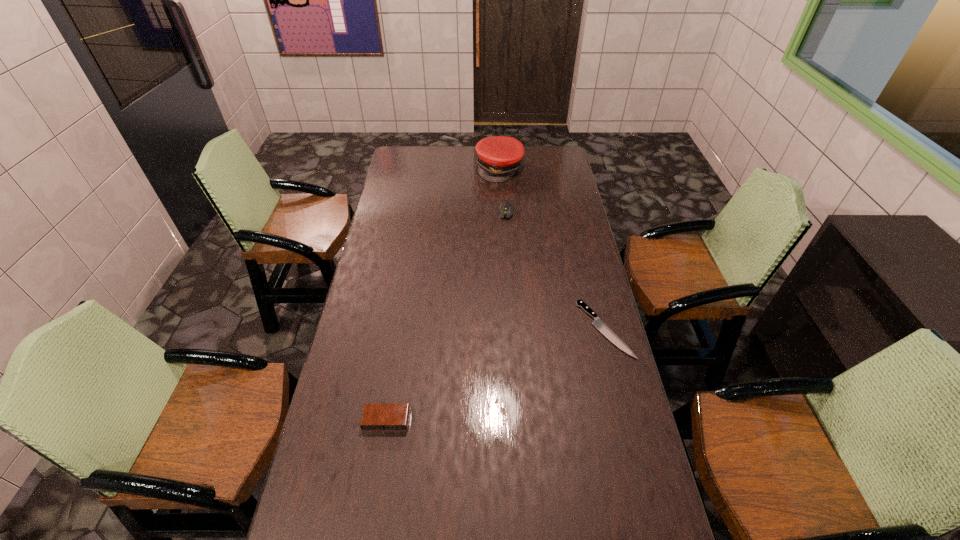
Locate an element on the screen. The width and height of the screenshot is (960, 540). free space on the desktop that is between the leftmost object and the shortest object and is positioned on the wheel side of the third nearest object is located at coordinates (486, 379).

You are a GUI agent. You are given a task and a screenshot of the screen. Output one action in this format:
    pyautogui.click(x=<x>, y=<y>)
    Task: Click on the free space on the desktop that is between the nearest object and the steak knife and is positioned on the front of the tallest object with an emblem
    Image resolution: width=960 pixels, height=540 pixels.
    Given the screenshot: What is the action you would take?
    pyautogui.click(x=532, y=360)